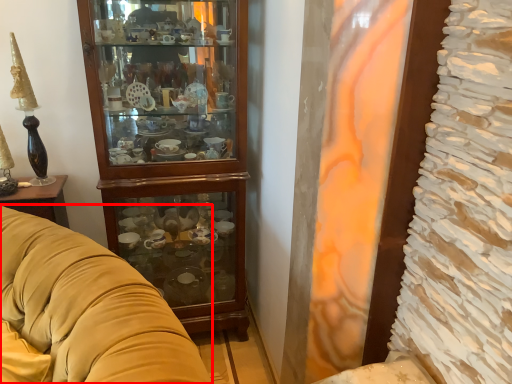
Question: From the image's perspective, considering the relative positions of studio couch (annotated by the red box) and cabinetry in the image provided, where is studio couch (annotated by the red box) located with respect to the staircase?

Choices:
 (A) above
 (B) below

Answer: (B)